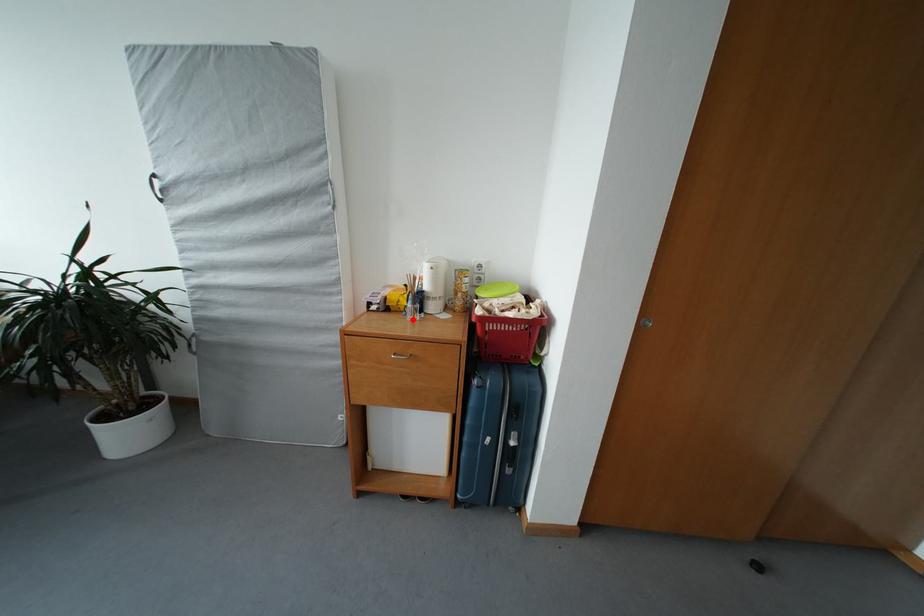
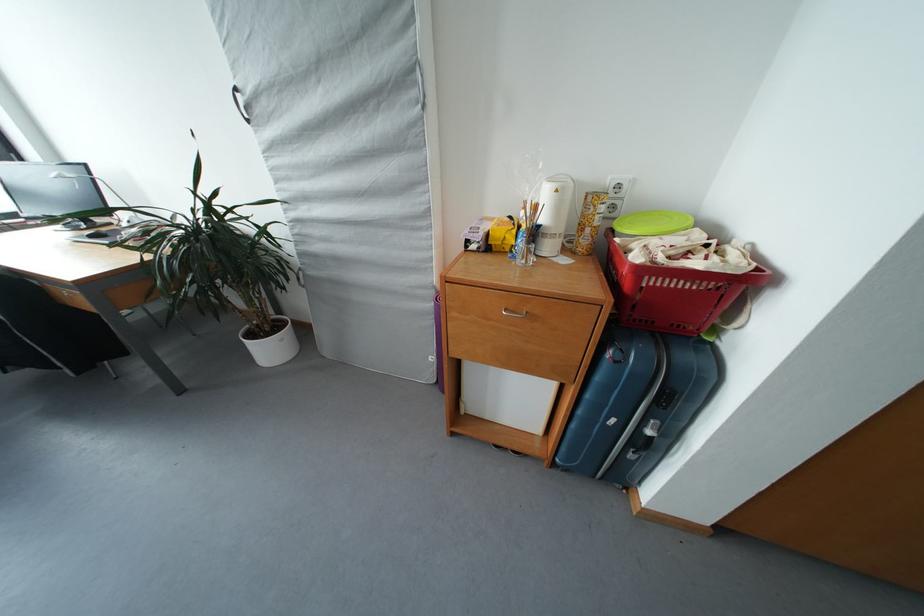
The point at the highlighted location is marked in the first image. Where is the corresponding point in the second image?

(520, 262)